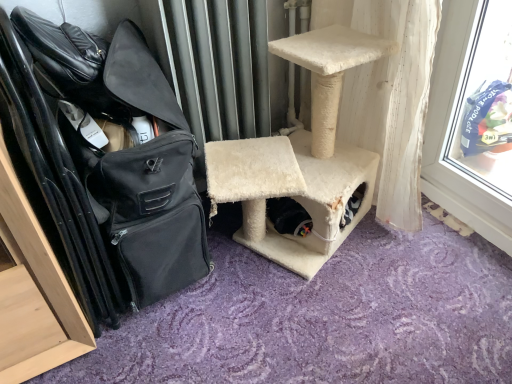
The height and width of the screenshot is (384, 512). In order to click on black fabric shoulder bag at left in this screenshot , I will do `click(127, 150)`.

What do you see at coordinates (127, 150) in the screenshot? The width and height of the screenshot is (512, 384). I see `black fabric shoulder bag at left` at bounding box center [127, 150].

Identify the location of beige carpeted cat tree at center. (301, 158).

Describe the element at coordinates (301, 158) in the screenshot. The width and height of the screenshot is (512, 384). I see `beige carpeted cat tree at center` at that location.

What is the approximate height of beige carpeted cat tree at center?

beige carpeted cat tree at center is 25.56 inches in height.

I want to click on black fabric shoulder bag at left, so click(127, 150).

Considering the relative positions of black fabric shoulder bag at left and beige carpeted cat tree at center in the image provided, is black fabric shoulder bag at left to the right of beige carpeted cat tree at center from the viewer's perspective?

In fact, black fabric shoulder bag at left is to the left of beige carpeted cat tree at center.

Which object is closer to the camera, black fabric shoulder bag at left or beige carpeted cat tree at center?

black fabric shoulder bag at left is closer to the camera.

Does point (191, 260) come closer to viewer compared to point (320, 117)?

Yes, it is.

Consider the image. From the image's perspective, is black fabric shoulder bag at left under beige carpeted cat tree at center?

Yes, from the image's perspective, black fabric shoulder bag at left is below beige carpeted cat tree at center.

From a real-world perspective, is black fabric shoulder bag at left physically located above or below beige carpeted cat tree at center?

black fabric shoulder bag at left is situated higher than beige carpeted cat tree at center in the real world.

Considering the sizes of objects black fabric shoulder bag at left and beige carpeted cat tree at center in the image provided, who is wider, black fabric shoulder bag at left or beige carpeted cat tree at center?

Wider between the two is beige carpeted cat tree at center.

Considering the relative sizes of black fabric shoulder bag at left and beige carpeted cat tree at center in the image provided, is black fabric shoulder bag at left taller than beige carpeted cat tree at center?

Yes, black fabric shoulder bag at left is taller than beige carpeted cat tree at center.

Does black fabric shoulder bag at left have a larger size compared to beige carpeted cat tree at center?

No.

Which is correct: black fabric shoulder bag at left is inside beige carpeted cat tree at center, or outside of it?

black fabric shoulder bag at left cannot be found inside beige carpeted cat tree at center.

Can you see black fabric shoulder bag at left touching beige carpeted cat tree at center?

No, black fabric shoulder bag at left is not next to beige carpeted cat tree at center.

Is black fabric shoulder bag at left oriented away from beige carpeted cat tree at center?

No, black fabric shoulder bag at left's orientation is not away from beige carpeted cat tree at center.

Can you tell me how much black fabric shoulder bag at left and beige carpeted cat tree at center differ in facing direction?

5.05 degrees separate the facing orientations of black fabric shoulder bag at left and beige carpeted cat tree at center.

How far apart are black fabric shoulder bag at left and beige carpeted cat tree at center?

34.78 centimeters.

Identify the location of furniture behind the black fabric shoulder bag at left. (301, 158).

Between beige carpeted cat tree at center and black fabric shoulder bag at left, which one appears on the right side from the viewer's perspective?

Positioned to the right is beige carpeted cat tree at center.

Is beige carpeted cat tree at center closer to the viewer compared to black fabric shoulder bag at left?

No, beige carpeted cat tree at center is further to the viewer.

Considering the points (285, 181) and (195, 191), which point is in front, point (285, 181) or point (195, 191)?

The point (195, 191) is more forward.

From the image's perspective, would you say beige carpeted cat tree at center is shown under black fabric shoulder bag at left?

Incorrect, from the image's perspective, beige carpeted cat tree at center is higher than black fabric shoulder bag at left.

From a real-world perspective, who is located higher, beige carpeted cat tree at center or black fabric shoulder bag at left?

From a 3D spatial view, black fabric shoulder bag at left is above.

Which object is wider, beige carpeted cat tree at center or black fabric shoulder bag at left?

Wider between the two is beige carpeted cat tree at center.

Who is shorter, beige carpeted cat tree at center or black fabric shoulder bag at left?

beige carpeted cat tree at center is shorter.

Which of these two, beige carpeted cat tree at center or black fabric shoulder bag at left, is bigger?

Bigger between the two is beige carpeted cat tree at center.

Is black fabric shoulder bag at left located within beige carpeted cat tree at center?

Actually, black fabric shoulder bag at left is outside beige carpeted cat tree at center.

Is beige carpeted cat tree at center not near black fabric shoulder bag at left?

No, beige carpeted cat tree at center is not far from black fabric shoulder bag at left.

Is beige carpeted cat tree at center facing towards black fabric shoulder bag at left?

No, beige carpeted cat tree at center is not oriented towards black fabric shoulder bag at left.

Can you tell me how much beige carpeted cat tree at center and black fabric shoulder bag at left differ in facing direction?

5.05 degrees separate the facing orientations of beige carpeted cat tree at center and black fabric shoulder bag at left.

The height and width of the screenshot is (384, 512). In the image, there is a beige carpeted cat tree at center. Identify the location of shoulder bag below it (from the image's perspective). (127, 150).

Locate an element on the screen. The image size is (512, 384). shoulder bag on the left of beige carpeted cat tree at center is located at coordinates (127, 150).

Locate an element on the screen. The height and width of the screenshot is (384, 512). furniture behind the black fabric shoulder bag at left is located at coordinates (301, 158).